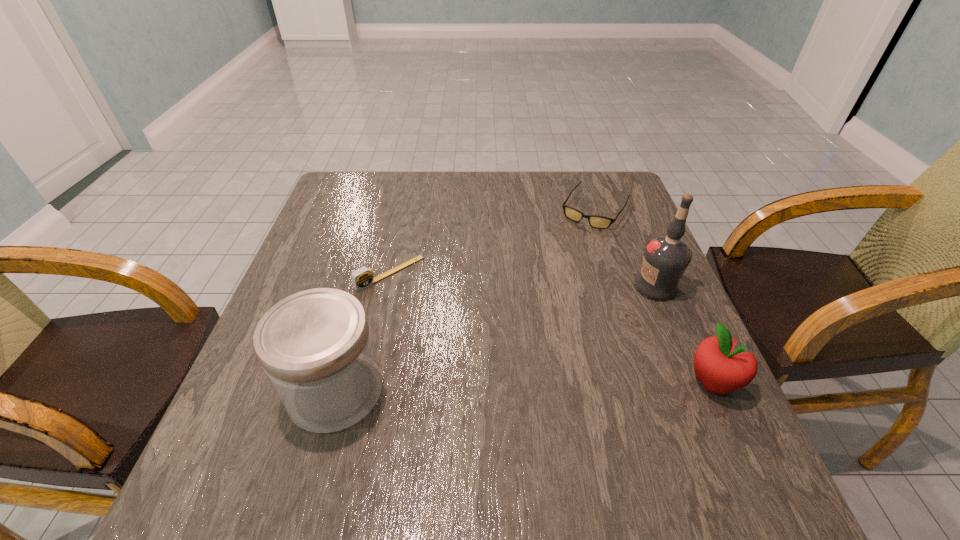
Identify the location of tape measure that is positioned at the left edge. The width and height of the screenshot is (960, 540). (362, 278).

In order to click on apple at the right edge in this screenshot , I will do pyautogui.click(x=721, y=370).

The image size is (960, 540). I want to click on vodka present at the right edge, so click(666, 257).

Where is `sunglasses present at the right edge`? The image size is (960, 540). sunglasses present at the right edge is located at coordinates (595, 221).

You are a GUI agent. You are given a task and a screenshot of the screen. Output one action in this format:
    pyautogui.click(x=<x>, y=<y>)
    Task: Click on the object located at the near left corner
    Image resolution: width=960 pixels, height=540 pixels.
    Given the screenshot: What is the action you would take?
    pyautogui.click(x=316, y=348)

Find the location of a particular element. The height and width of the screenshot is (540, 960). object that is at the far right corner is located at coordinates click(x=595, y=221).

The image size is (960, 540). What are the coordinates of `object located in the near right corner section of the desktop` in the screenshot? It's located at (721, 370).

What are the coordinates of `vacant region at the far edge of the desktop` in the screenshot? It's located at (387, 197).

In the image, there is a desktop. Identify the location of vacant space at the near edge. The image size is (960, 540). (527, 406).

Where is `free space at the left edge`? The image size is (960, 540). free space at the left edge is located at coordinates (343, 246).